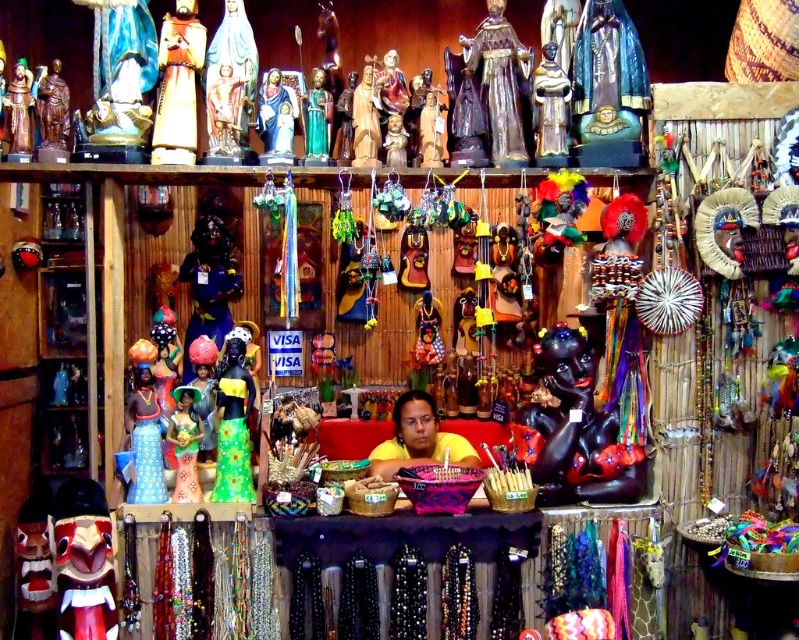
Question: Can you confirm if shiny green fabric doll at center is positioned below gold metallic statue at upper center?

Choices:
 (A) no
 (B) yes

Answer: (B)

Question: Can you confirm if shiny green fabric doll at center is thinner than matte blue fabric doll at left?

Choices:
 (A) yes
 (B) no

Answer: (A)

Question: Which object is the closest to the matte blue fabric doll at left?

Choices:
 (A) gold metallic statue at upper center
 (B) yellow matte shirt at center
 (C) shiny gold statue at upper center

Answer: (A)

Question: Considering the real-world distances, which object is farthest from the shiny green fabric doll at center?

Choices:
 (A) matte blue fabric doll at left
 (B) matte green fabric doll at center
 (C) shiny gold statue at upper center

Answer: (C)

Question: Can you confirm if matte blue fabric doll at left is positioned below yellow matte shirt at center?

Choices:
 (A) yes
 (B) no

Answer: (B)

Question: Estimate the real-world distances between objects in this image. Which object is closer to the gold metallic statue at upper center?

Choices:
 (A) matte green fabric doll at center
 (B) yellow matte shirt at center

Answer: (A)